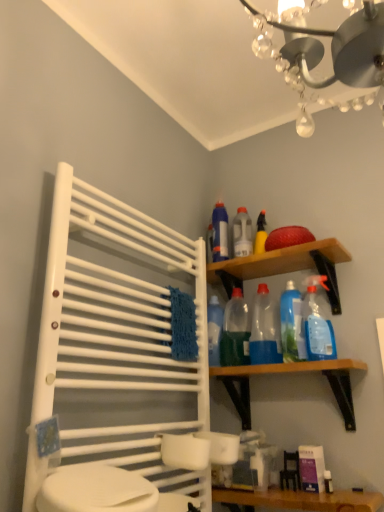
Question: Is the depth of wooden shelf at upper right, the first shelf when ordered from top to bottom, greater than that of transparent plastic bottles at upper center, marked as the third cleaning product in a right-to-left arrangement?

Choices:
 (A) yes
 (B) no

Answer: (B)

Question: Is wooden shelf at upper right, which is the 2th shelf from bottom to top, positioned with its back to transparent plastic bottles at upper center, marked as the third cleaning product in a right-to-left arrangement?

Choices:
 (A) no
 (B) yes

Answer: (B)

Question: Is wooden shelf at upper right, the first shelf when ordered from top to bottom, closer to the viewer compared to transparent plastic bottles at upper center, marked as the third cleaning product in a right-to-left arrangement?

Choices:
 (A) no
 (B) yes

Answer: (B)

Question: Can we say wooden shelf at upper right, the first shelf when ordered from top to bottom, lies outside transparent plastic bottles at upper center, the 2th cleaning product in the left-to-right sequence?

Choices:
 (A) no
 (B) yes

Answer: (B)

Question: Can you confirm if wooden shelf at upper right, the first shelf when ordered from top to bottom, is positioned to the right of transparent plastic bottles at upper center, the 2th cleaning product in the left-to-right sequence?

Choices:
 (A) yes
 (B) no

Answer: (A)

Question: From the image's perspective, would you say wooden shelf at upper right, which is the 2th shelf from bottom to top, is positioned over transparent plastic bottles at upper center, marked as the third cleaning product in a right-to-left arrangement?

Choices:
 (A) no
 (B) yes

Answer: (B)

Question: Is wooden vanity at lower center facing away from white plastic towel rack at left?

Choices:
 (A) yes
 (B) no

Answer: (B)

Question: Is wooden vanity at lower center with white plastic towel rack at left?

Choices:
 (A) yes
 (B) no

Answer: (B)

Question: Does wooden vanity at lower center have a lesser width compared to white plastic towel rack at left?

Choices:
 (A) yes
 (B) no

Answer: (B)

Question: From a real-world perspective, is wooden vanity at lower center on white plastic towel rack at left?

Choices:
 (A) yes
 (B) no

Answer: (B)

Question: Can you confirm if wooden vanity at lower center is positioned to the right of white plastic towel rack at left?

Choices:
 (A) no
 (B) yes

Answer: (B)

Question: Does wooden vanity at lower center have a greater height compared to white plastic towel rack at left?

Choices:
 (A) no
 (B) yes

Answer: (A)

Question: Does wooden shelf at upper right, which is the 2th shelf from bottom to top, come behind wooden vanity at lower center?

Choices:
 (A) no
 (B) yes

Answer: (B)